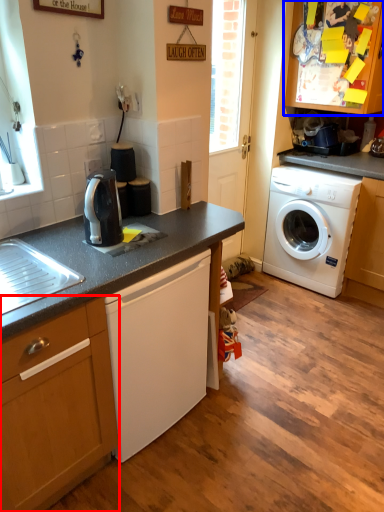
Question: Which object appears farthest to the camera in this image, cabinetry (highlighted by a red box) or cabinetry (highlighted by a blue box)?

Choices:
 (A) cabinetry
 (B) cabinetry

Answer: (B)